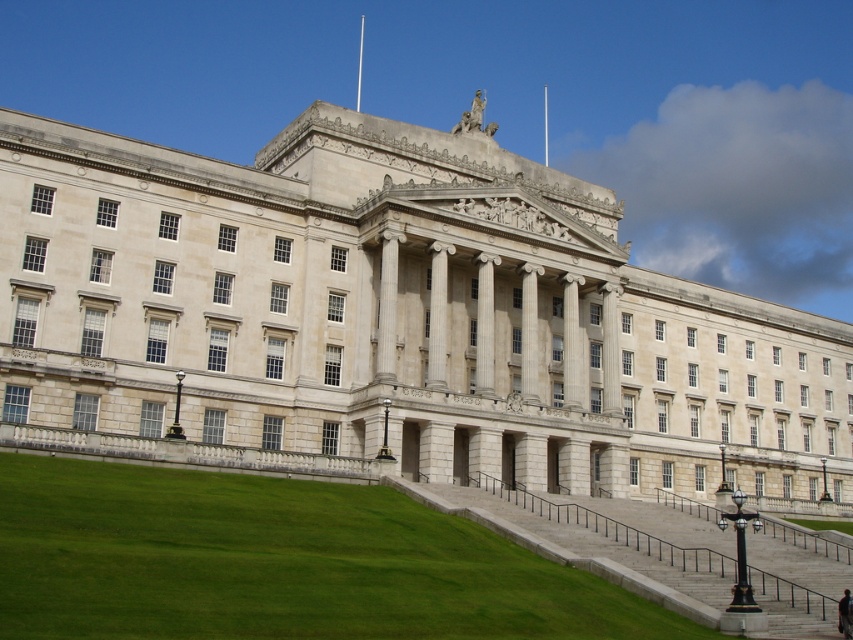
You are standing on the green grass at lower left looking towards the white stone building at center. Which object is taller?

The white stone building at center is taller than the green grass at lower left.

You are standing on the lawn in front of the white stone building at center. If you face directly towards the building, which direction would you need to walk to reach the entrance located at the base of the steps?

Since the white stone building at center is positioned at the center point of the image, you would need to walk straight ahead towards the building to reach the entrance at the base of the steps.

You are standing at the base of the wide stone steps leading up to the white stone building at center. You want to take a photo of the building while standing at this position. Considering the distance between you and the building, would you need to use a zoom lens to capture the entire facade in your photo?

The distance between you and the white stone building at center is 45.33 meters. Since you are standing at the base of the steps, a standard lens might suffice to capture the entire facade without needing significant zoom, but using a zoom lens could help ensure the building fills the frame appropriately.